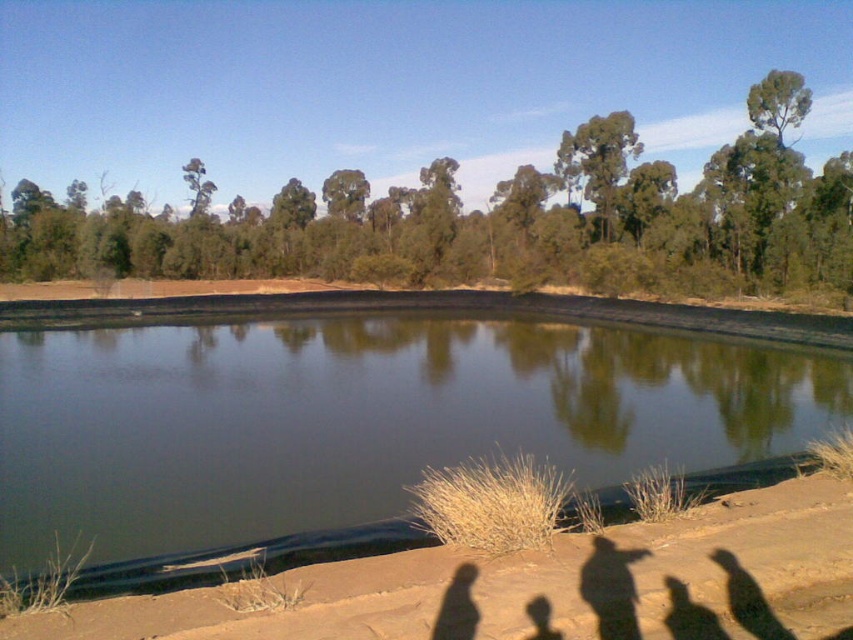
Is point (112, 504) behind point (782, 627)?

Yes, point (112, 504) is behind point (782, 627).

Between greenish-brown water at center and brown sandy shore at lower center, which one appears on the right side from the viewer's perspective?

brown sandy shore at lower center

Does point (364, 451) come in front of point (659, 593)?

That is False.

Identify the location of greenish-brown water at center. The width and height of the screenshot is (853, 640). (368, 419).